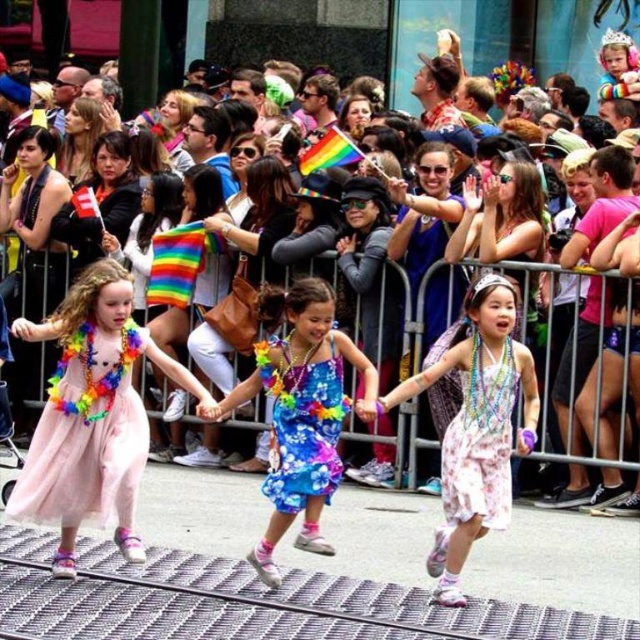
You are a photographer at the parade and want to capture both the floral fabric dress at center and the floral print fabric dress at center in a single shot. Which dress should you focus on to ensure both are in frame without moving the camera?

The floral fabric dress at center is larger in size compared to the floral print fabric dress at center, so focusing on the larger one will help ensure both are within the camera frame.

Looking at this image, you are a photographer standing at the origin point of the image. You want to capture the floral fabric dress at center in your shot. Which direction should you move to get closer to it?

The floral fabric dress at center is located at coordinate point 0.647 on the x axis and 0.472 on the y axis. Since the photographer is at the origin point, moving towards the positive x and positive y direction would bring them closer to the dress.